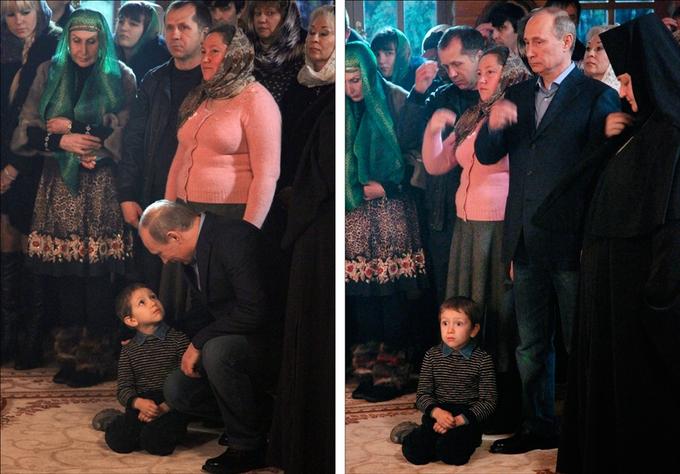
This screenshot has height=474, width=680. I want to click on rug, so click(71, 437).